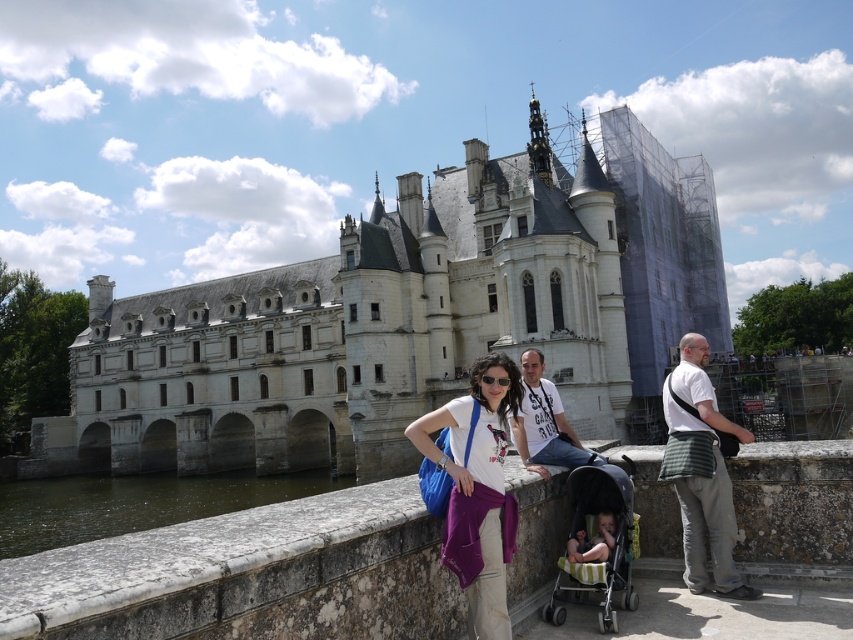
You are a photographer trying to capture a photo of the purple fabric at center and the green striped fabric stroller at center. Which object should you focus on first if you want to ensure both are in sharp focus?

The purple fabric at center is taller than the green striped fabric stroller at center. To ensure both are in sharp focus, focus on the purple fabric at center since it is taller and will require a smaller aperture or a closer focus distance.